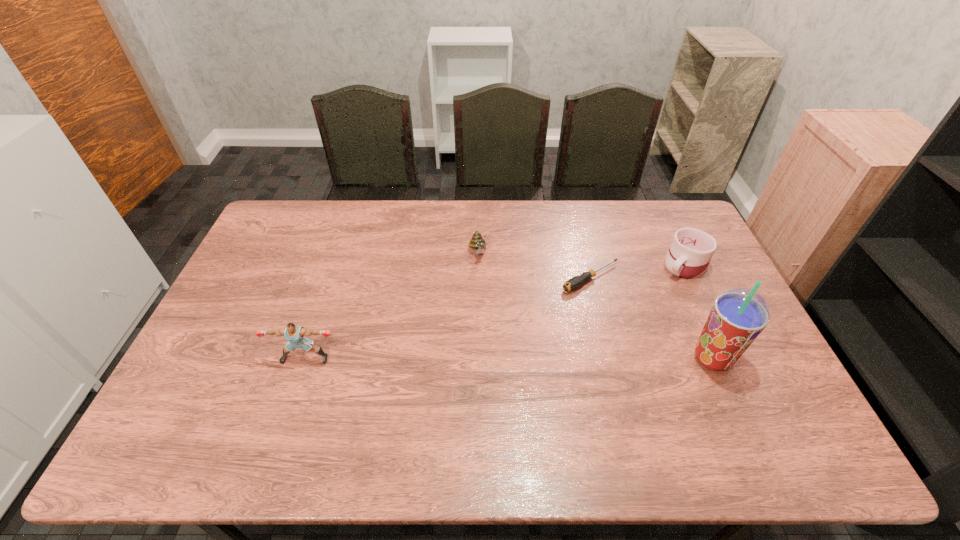
At what (x,y) coordinates should I click in order to perform the action: click on the leftmost object. Please return your answer as a coordinate pair (x, y). The height and width of the screenshot is (540, 960). Looking at the image, I should click on (294, 334).

At what (x,y) coordinates should I click in order to perform the action: click on the fourth shortest object. Please return your answer as a coordinate pair (x, y). The height and width of the screenshot is (540, 960). Looking at the image, I should click on (294, 334).

You are a GUI agent. You are given a task and a screenshot of the screen. Output one action in this format:
    pyautogui.click(x=<x>, y=<y>)
    Task: Click on the smoothie
    The image size is (960, 540).
    Given the screenshot: What is the action you would take?
    pyautogui.click(x=739, y=315)

You are a GUI agent. You are given a task and a screenshot of the screen. Output one action in this format:
    pyautogui.click(x=<x>, y=<y>)
    Task: Click on the third object from left to right
    The width and height of the screenshot is (960, 540).
    Given the screenshot: What is the action you would take?
    pyautogui.click(x=575, y=282)

You are a GUI agent. You are given a task and a screenshot of the screen. Output one action in this format:
    pyautogui.click(x=<x>, y=<y>)
    Task: Click on the shortest object
    The image size is (960, 540).
    Given the screenshot: What is the action you would take?
    pyautogui.click(x=575, y=282)

At what (x,y) coordinates should I click in order to perform the action: click on the second object from left to right. Please return your answer as a coordinate pair (x, y). The image size is (960, 540). Looking at the image, I should click on (477, 242).

The width and height of the screenshot is (960, 540). In order to click on mug in this screenshot , I will do `click(691, 250)`.

At what (x,y) coordinates should I click in order to perform the action: click on blank space located on the front-facing side of the puncher. Please return your answer as a coordinate pair (x, y). Looking at the image, I should click on (298, 381).

Find the location of a particular element. vacant space located 0.060m on the front of the smoothie is located at coordinates (730, 399).

Identify the location of vacant space located at the tip of the third object from right to left. (520, 314).